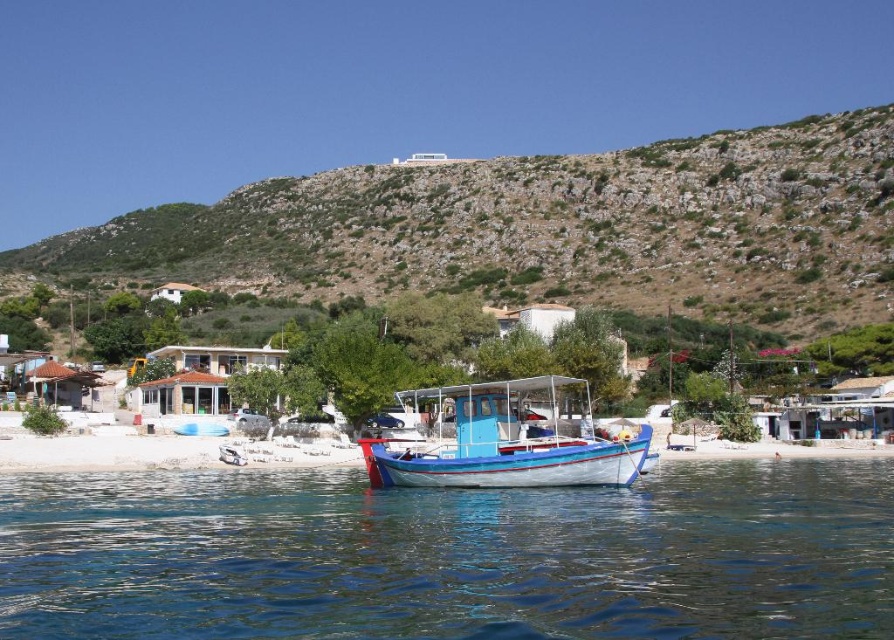
Between brown rocky hillside at upper center and blue painted wooden boat at center, which one is positioned higher?

brown rocky hillside at upper center

This screenshot has height=640, width=894. Identify the location of brown rocky hillside at upper center. (551, 228).

Which is below, blue painted wooden boat at center or white sand beach at lower center?

white sand beach at lower center is lower down.

Measure the distance between blue painted wooden boat at center and camera.

A distance of 170.54 feet exists between blue painted wooden boat at center and camera.

Where is `blue painted wooden boat at center`? blue painted wooden boat at center is located at coordinates (509, 442).

The width and height of the screenshot is (894, 640). What do you see at coordinates (551, 228) in the screenshot?
I see `brown rocky hillside at upper center` at bounding box center [551, 228].

The width and height of the screenshot is (894, 640). In order to click on brown rocky hillside at upper center in this screenshot , I will do `click(551, 228)`.

What do you see at coordinates (551, 228) in the screenshot? Image resolution: width=894 pixels, height=640 pixels. I see `brown rocky hillside at upper center` at bounding box center [551, 228].

Locate an element on the screen. The height and width of the screenshot is (640, 894). brown rocky hillside at upper center is located at coordinates (551, 228).